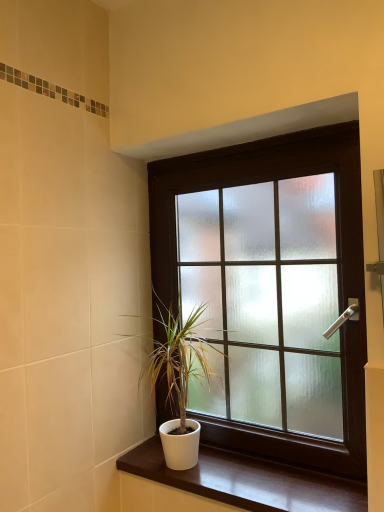
Where is `vacant space situated above white glossy wood at lower center (from a real-world perspective)`? This screenshot has height=512, width=384. vacant space situated above white glossy wood at lower center (from a real-world perspective) is located at coordinates (247, 477).